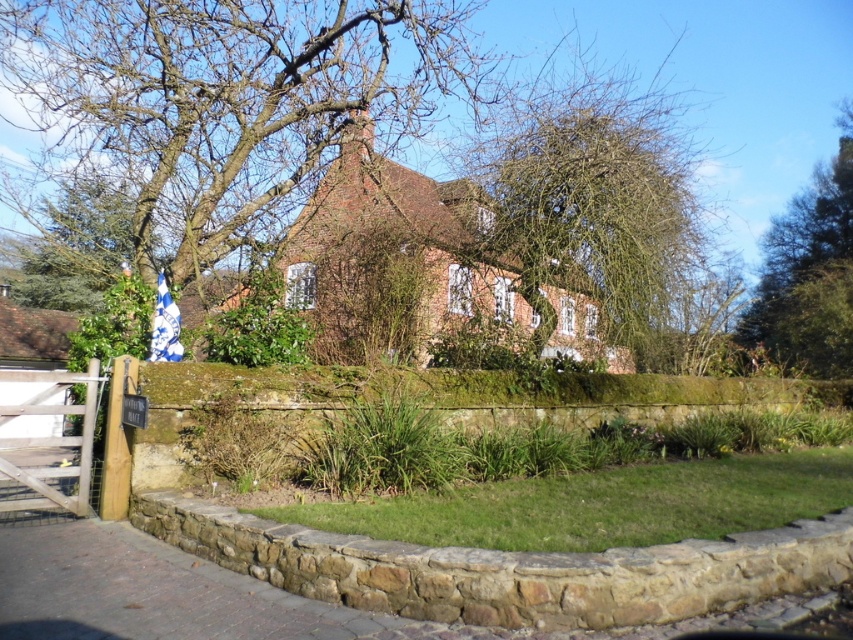
Does bare branches at upper center lie in front of bare branches at center?

That is False.

The image size is (853, 640). What do you see at coordinates (219, 102) in the screenshot?
I see `bare branches at upper center` at bounding box center [219, 102].

The width and height of the screenshot is (853, 640). Find the location of `bare branches at upper center`. bare branches at upper center is located at coordinates (219, 102).

Which is more to the right, bare branches at upper center or green leafy tree at upper right?

Positioned to the right is green leafy tree at upper right.

Is bare branches at upper center to the left of green leafy tree at upper right from the viewer's perspective?

Correct, you'll find bare branches at upper center to the left of green leafy tree at upper right.

Is point (462, 67) less distant than point (816, 177)?

Yes.

Identify the location of bare branches at upper center. This screenshot has height=640, width=853. (219, 102).

Is point (625, 344) positioned after point (815, 288)?

That is False.

Is the position of bare branches at center more distant than that of green leafy tree at upper right?

That is False.

What do you see at coordinates (605, 218) in the screenshot?
I see `bare branches at center` at bounding box center [605, 218].

What are the coordinates of `bare branches at center` in the screenshot? It's located at (605, 218).